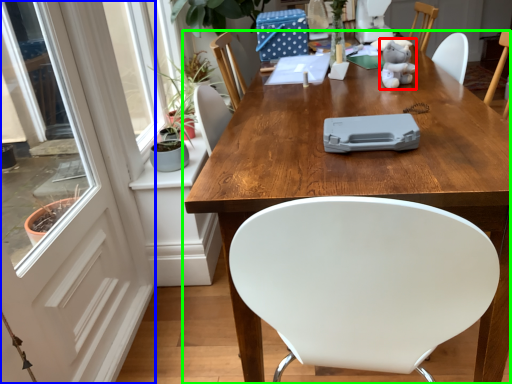
Question: Estimate the real-world distances between objects in this image. Which object is closer to toy (highlighted by a red box), screen door (highlighted by a blue box) or table (highlighted by a green box)?

Choices:
 (A) screen door
 (B) table

Answer: (B)